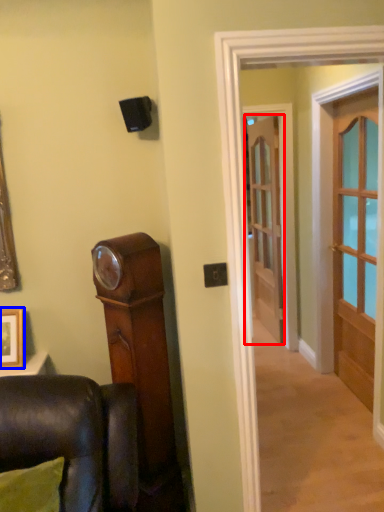
Question: Which of the following is the closest to the observer, door (highlighted by a red box) or picture frame (highlighted by a blue box)?

Choices:
 (A) door
 (B) picture frame

Answer: (B)